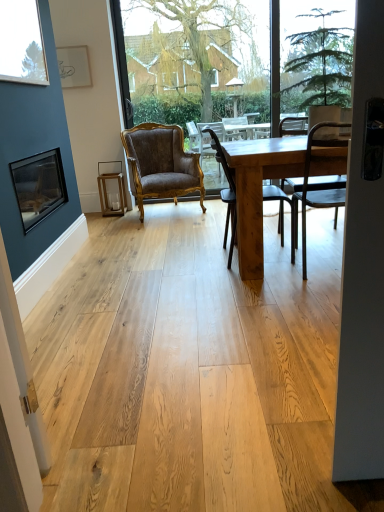
Question: Does clear glass window at upper left lie behind matte black picture frame at left?

Choices:
 (A) no
 (B) yes

Answer: (A)

Question: Can you confirm if clear glass window at upper left is positioned to the right of matte black picture frame at left?

Choices:
 (A) yes
 (B) no

Answer: (A)

Question: From a real-world perspective, is clear glass window at upper left beneath matte black picture frame at left?

Choices:
 (A) yes
 (B) no

Answer: (B)

Question: Considering the relative sizes of clear glass window at upper left and matte black picture frame at left in the image provided, is clear glass window at upper left taller than matte black picture frame at left?

Choices:
 (A) no
 (B) yes

Answer: (B)

Question: Does clear glass window at upper left have a greater width compared to matte black picture frame at left?

Choices:
 (A) yes
 (B) no

Answer: (B)

Question: From the image's perspective, relative to natural wood table at center, is black metal chair at right, which is the first chair from right to left, above or below?

Choices:
 (A) above
 (B) below

Answer: (B)

Question: Is black metal chair at right, which is the first chair from right to left, inside or outside of natural wood table at center?

Choices:
 (A) outside
 (B) inside

Answer: (B)

Question: Is point (307, 197) positioned closer to the camera than point (301, 170)?

Choices:
 (A) closer
 (B) farther

Answer: (B)

Question: Looking at the image, does black metal chair at right, which is the first chair from right to left, seem bigger or smaller compared to natural wood table at center?

Choices:
 (A) big
 (B) small

Answer: (B)

Question: Is point (301, 201) closer or farther from the camera than point (29, 65)?

Choices:
 (A) farther
 (B) closer

Answer: (A)

Question: From the image's perspective, is black metal chair at right, which is the first chair from right to left, positioned above or below clear glass window at upper left?

Choices:
 (A) above
 (B) below

Answer: (B)

Question: Considering the positions of black metal chair at right, the 1th chair positioned from the front, and clear glass window at upper left in the image, is black metal chair at right, the 1th chair positioned from the front, taller or shorter than clear glass window at upper left?

Choices:
 (A) tall
 (B) short

Answer: (A)

Question: In terms of width, does black metal chair at right, acting as the 3th chair starting from the back, look wider or thinner when compared to clear glass window at upper left?

Choices:
 (A) wide
 (B) thin

Answer: (A)

Question: Is wooden chair at center, which is the 2th window screen in front-to-back order, wider or thinner than natural wood table at center?

Choices:
 (A) thin
 (B) wide

Answer: (A)

Question: From the image's perspective, is wooden chair at center, which is the 2th window screen in front-to-back order, positioned above or below natural wood table at center?

Choices:
 (A) above
 (B) below

Answer: (A)